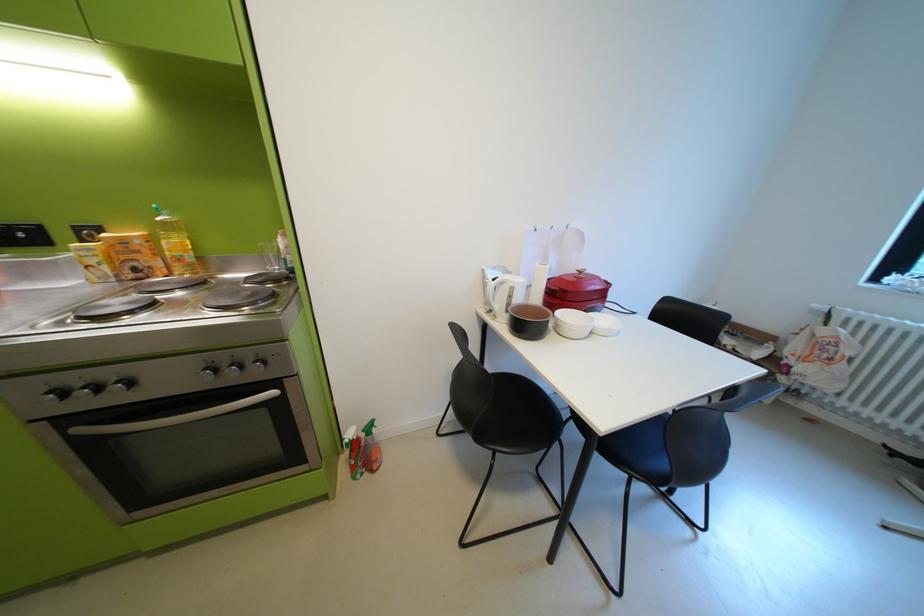
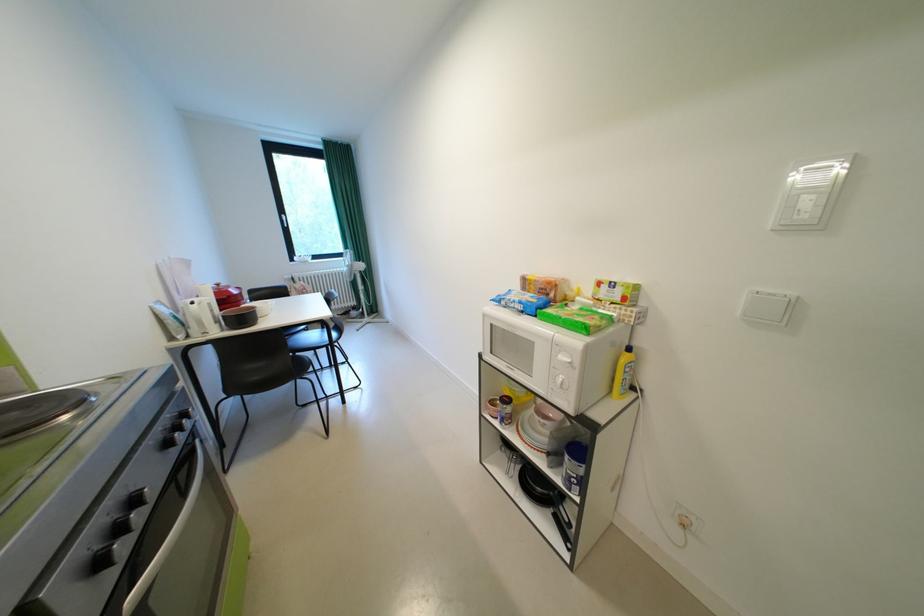
The point at (518, 305) is marked in the first image. Where is the corresponding point in the second image?

(225, 317)